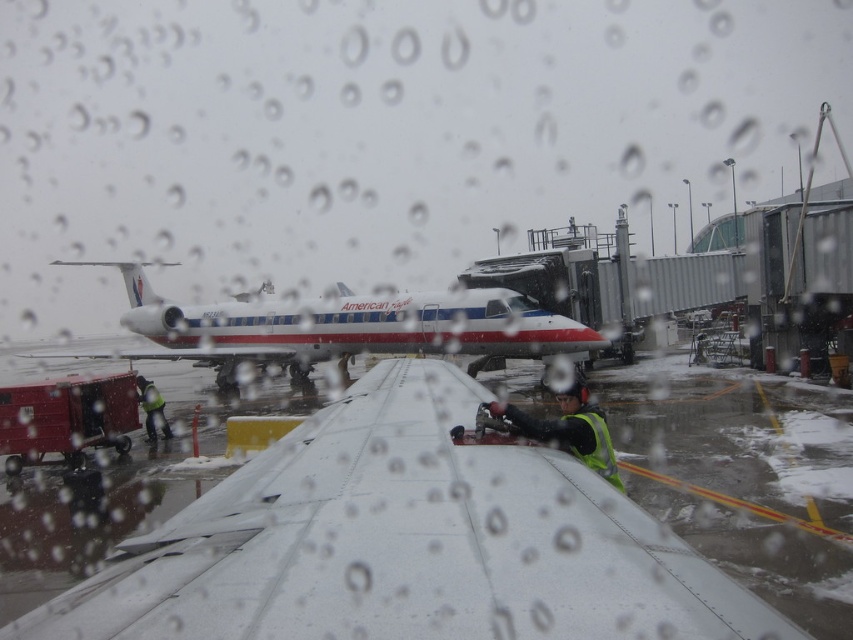
You are standing at the airport window and see a point marked at coordinates (344, 326). What object is located at that point?

The point at coordinates (344, 326) corresponds to the white glossy airplane at center.

You are standing at the airport window and want to know which of the two points, point (566, 435) or point (148, 384), is nearer to you. Can you determine this based on the image?

Point (566, 435) is closer to the camera than point (148, 384), so it is nearer to you.